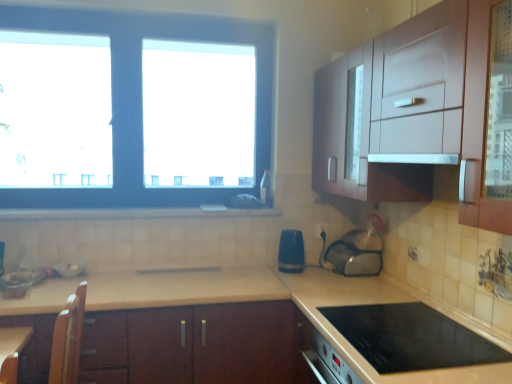
In order to click on free space that is to the left of transparent plastic bag at center, marked as the 1th appliance in a right-to-left arrangement in this screenshot , I will do `click(317, 271)`.